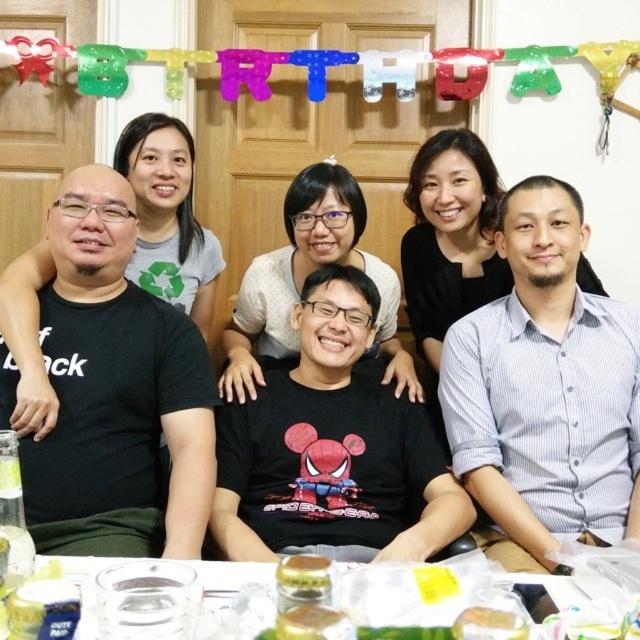
Question: Can you confirm if translucent glass jar at lower center is positioned to the left of translucent plastic container at lower center?

Choices:
 (A) yes
 (B) no

Answer: (A)

Question: Is black matte shirt at center closer to the viewer compared to translucent glass jar at lower center?

Choices:
 (A) yes
 (B) no

Answer: (B)

Question: Which of the following is the closest to the observer?

Choices:
 (A) translucent plastic container at lower center
 (B) black matte shirt at center

Answer: (A)

Question: Which object appears farthest from the camera in this image?

Choices:
 (A) translucent plastic container at lower center
 (B) transparent plastic table at lower center
 (C) black matte shirt at center

Answer: (C)

Question: Which object is positioned closest to the black matte shirt at center?

Choices:
 (A) translucent plastic container at lower center
 (B) translucent glass jar at lower center

Answer: (B)

Question: Can you confirm if black matte shirt at center is positioned to the left of translucent plastic container at lower center?

Choices:
 (A) yes
 (B) no

Answer: (A)